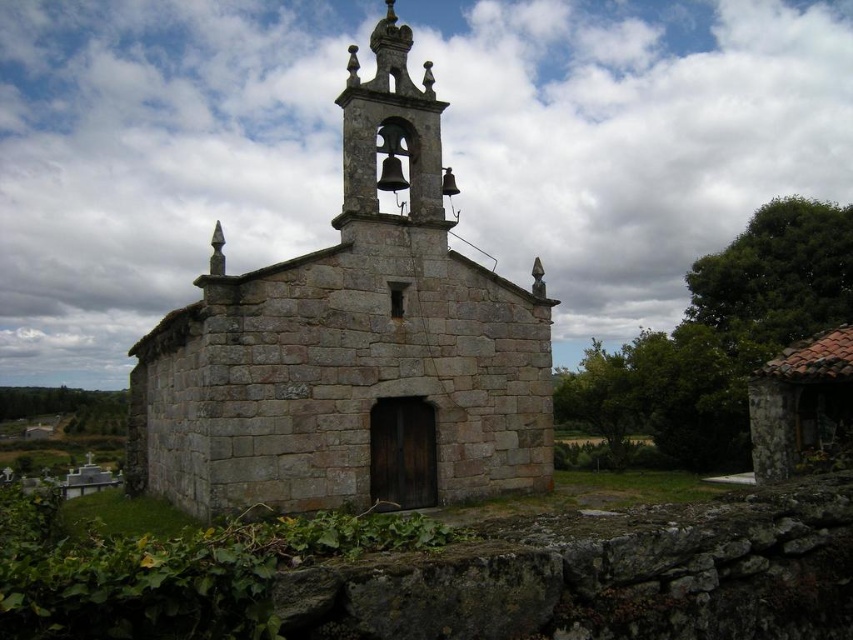
Question: Which point is farther to the camera?

Choices:
 (A) (363, 204)
 (B) (339, 486)

Answer: (A)

Question: Is gray stone church at center in front of polished bronze bell tower at upper center?

Choices:
 (A) no
 (B) yes

Answer: (B)

Question: Does gray stone church at center have a larger size compared to polished bronze bell tower at upper center?

Choices:
 (A) no
 (B) yes

Answer: (B)

Question: Which point is closer to the camera?

Choices:
 (A) [x=383, y=26]
 (B) [x=404, y=109]

Answer: (B)

Question: Is gray stone church at center to the left of polished bronze bell tower at upper center from the viewer's perspective?

Choices:
 (A) no
 (B) yes

Answer: (B)